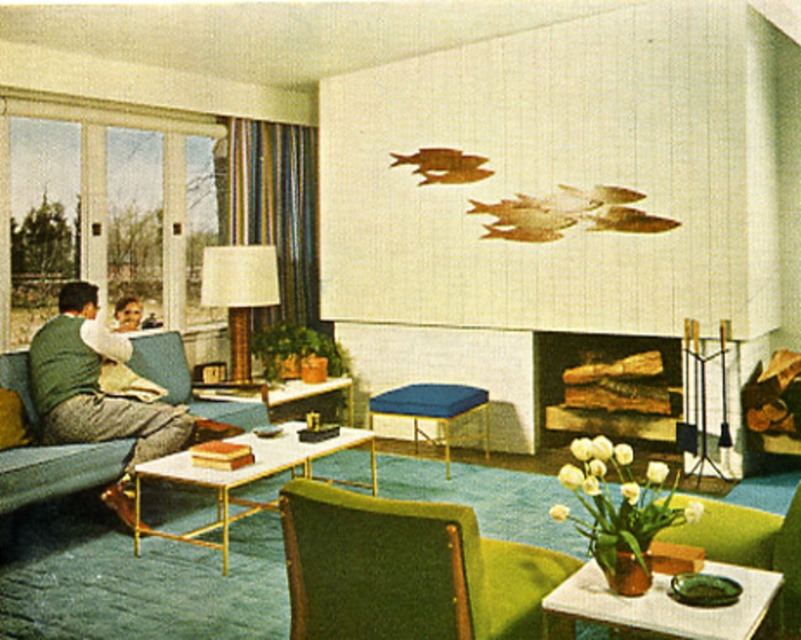
Who is higher up, green fabric armchair at lower center or green fabric couch at left?

Positioned higher is green fabric couch at left.

Is point (308, 580) positioned in front of point (119, 392)?

Yes, it is.

Which is behind, point (463, 524) or point (123, 481)?

The point (123, 481) is behind.

Locate an element on the screen. The width and height of the screenshot is (801, 640). green fabric armchair at lower center is located at coordinates (405, 570).

Is white marble coffee table at center wider than matte brown lampshade at center?

Yes.

Between point (369, 442) and point (248, 324), which one is positioned in front?

Point (369, 442)

Who is more forward, [186,452] or [248,252]?

Point [186,452] is in front.

At what (x,y) coordinates should I click in order to perform the action: click on white marble coffee table at center. Please return your answer as a coordinate pair (x, y). Looking at the image, I should click on point(244,476).

Is point (288, 561) positioned after point (276, 262)?

No, (288, 561) is closer to viewer.

Does green fabric armchair at lower center have a larger size compared to matte brown lampshade at center?

Indeed, green fabric armchair at lower center has a larger size compared to matte brown lampshade at center.

What do you see at coordinates (405, 570) in the screenshot? The width and height of the screenshot is (801, 640). I see `green fabric armchair at lower center` at bounding box center [405, 570].

At what (x,y) coordinates should I click in order to perform the action: click on green fabric armchair at lower center. Please return your answer as a coordinate pair (x, y). Looking at the image, I should click on (405, 570).